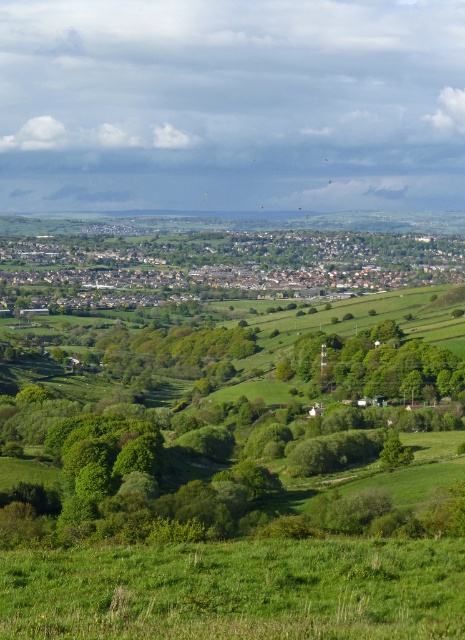
Question: Does green leafy tree at center come in front of green leafy trees at center?

Choices:
 (A) no
 (B) yes

Answer: (B)

Question: Which point is farther to the camera?

Choices:
 (A) (106, 636)
 (B) (221, 340)

Answer: (B)

Question: Does green grassy field at center come behind green leafy trees at center?

Choices:
 (A) yes
 (B) no

Answer: (A)

Question: Which object is positioned closest to the green grassy field at center?

Choices:
 (A) green leafy tree at center
 (B) green leafy trees at center

Answer: (B)

Question: Which point appears farthest from the camera in this image?

Choices:
 (A) (246, 352)
 (B) (166, 595)

Answer: (A)

Question: Is green grassy field at lower center further to the viewer compared to green leafy tree at center?

Choices:
 (A) no
 (B) yes

Answer: (A)